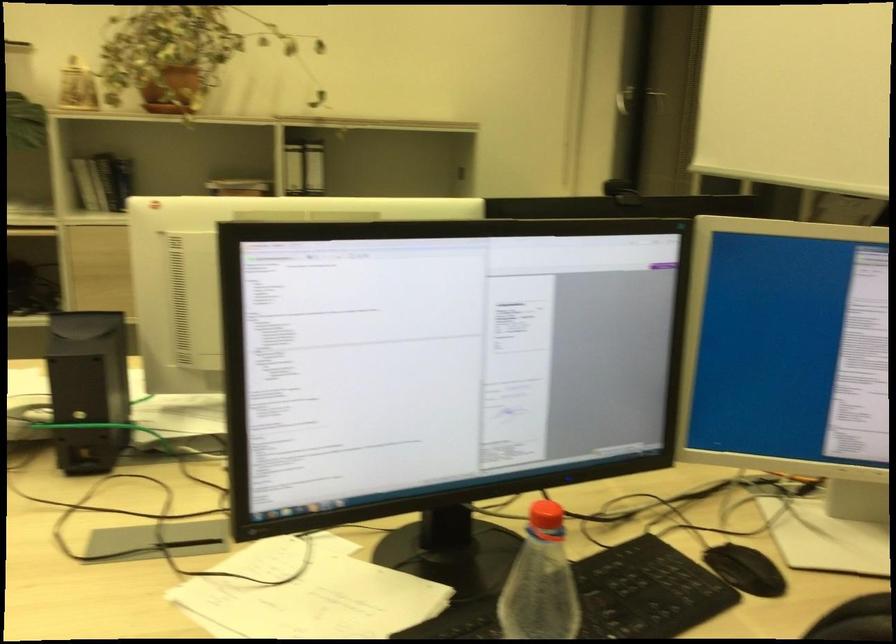
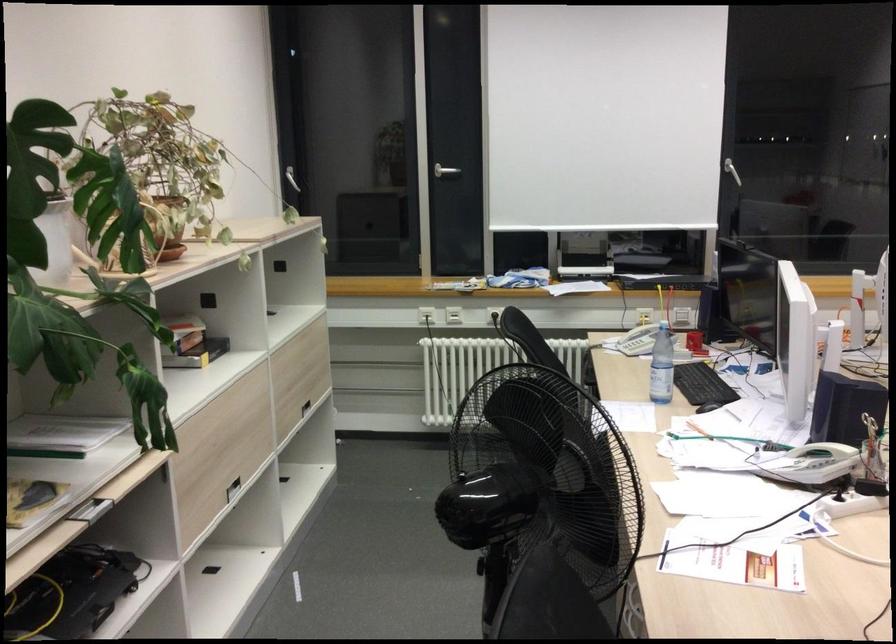
Find the pixel in the second image that matches (240,196) in the first image.

(192, 343)